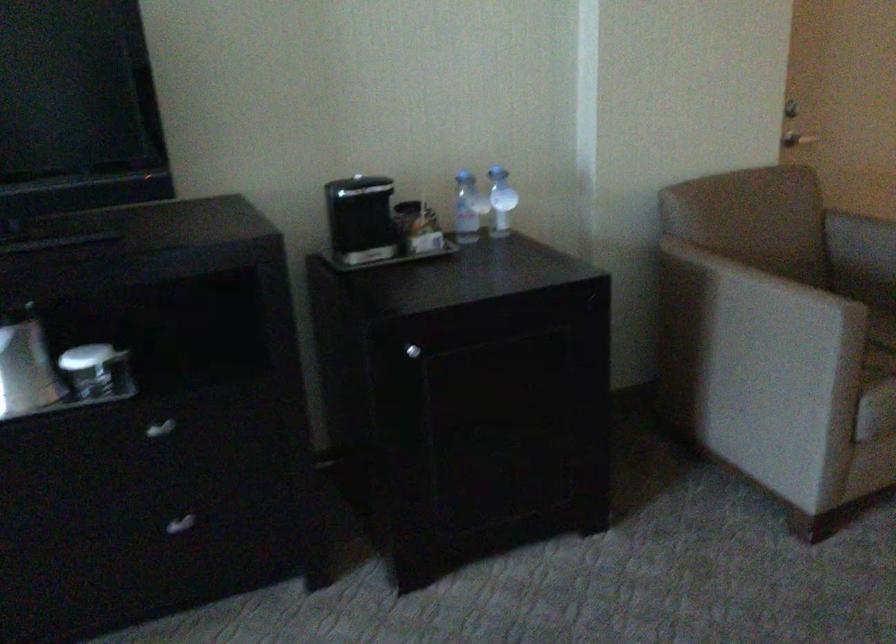
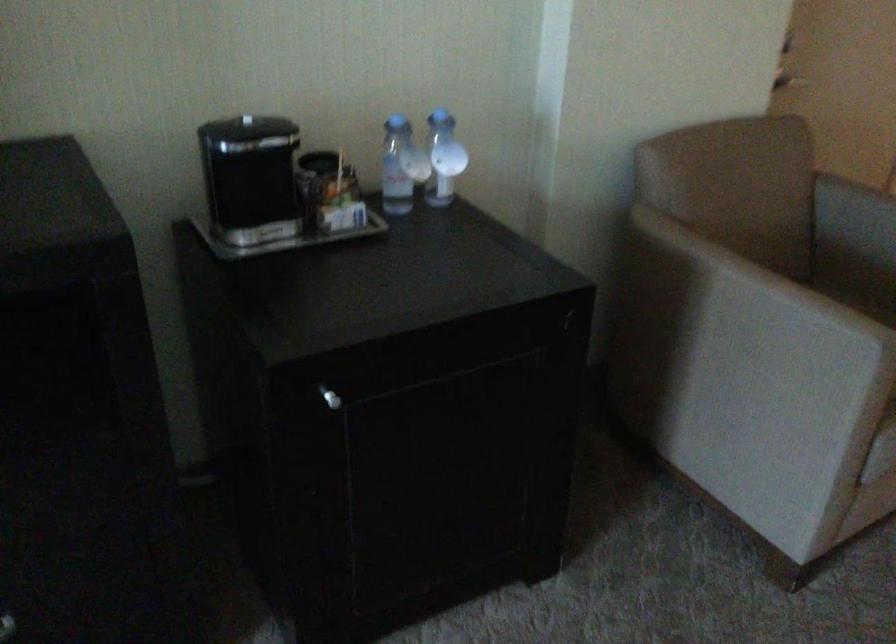
In the second image, find the point that corresponds to point 409,351 in the first image.

(330, 398)